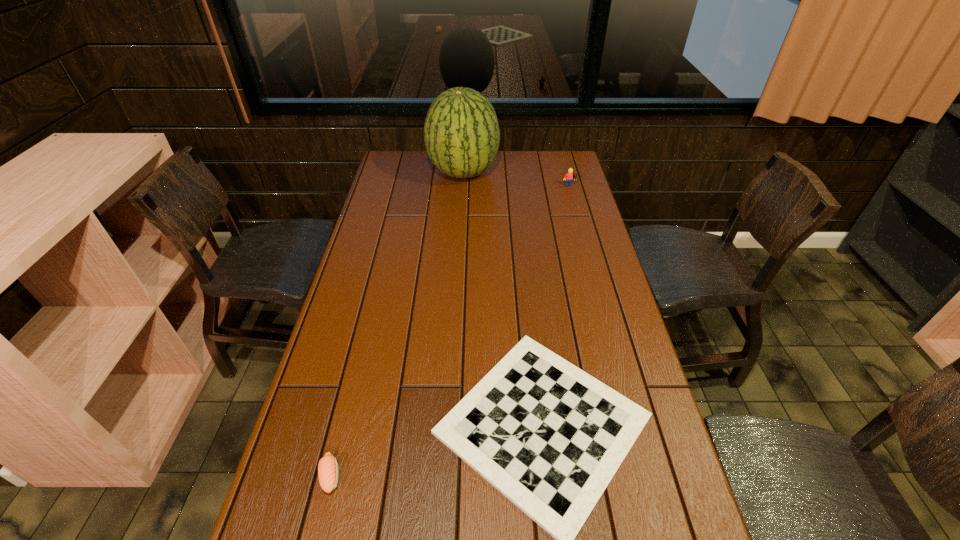
The width and height of the screenshot is (960, 540). I want to click on watermelon, so click(x=461, y=132).

Where is `the third shortest object`? This screenshot has width=960, height=540. the third shortest object is located at coordinates (569, 176).

At what (x,y) coordinates should I click in order to perform the action: click on sushi. Please return your answer as a coordinate pair (x, y). Looking at the image, I should click on (328, 472).

Where is `the leftmost object`? This screenshot has height=540, width=960. the leftmost object is located at coordinates (328, 472).

This screenshot has width=960, height=540. Find the location of `free space located 0.290m on the right of the tallest object`. free space located 0.290m on the right of the tallest object is located at coordinates (567, 172).

What are the coordinates of `vacant space situated on the front-facing side of the Lego` in the screenshot? It's located at tap(572, 199).

The width and height of the screenshot is (960, 540). Identify the location of vacant space located on the back of the third tallest object. (356, 372).

In order to click on object that is at the far edge in this screenshot , I will do `click(461, 132)`.

The image size is (960, 540). What are the coordinates of `object that is at the left edge` in the screenshot? It's located at (328, 472).

Identify the location of object positioned at the right edge. (569, 176).